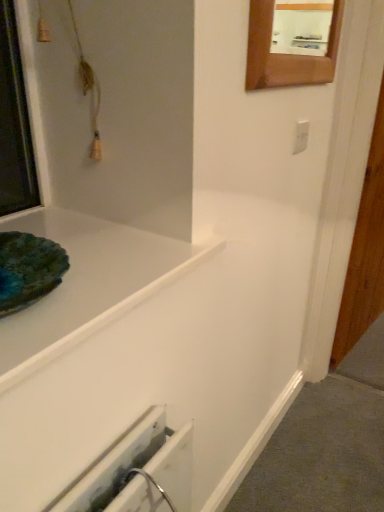
Question: Considering the relative sizes of white glossy bathtub at upper left and wooden frame mirror at upper right in the image provided, is white glossy bathtub at upper left shorter than wooden frame mirror at upper right?

Choices:
 (A) no
 (B) yes

Answer: (B)

Question: From a real-world perspective, does white glossy bathtub at upper left sit lower than wooden frame mirror at upper right?

Choices:
 (A) no
 (B) yes

Answer: (B)

Question: Is wooden frame mirror at upper right located within white glossy bathtub at upper left?

Choices:
 (A) no
 (B) yes

Answer: (A)

Question: Is there a large distance between white glossy bathtub at upper left and wooden frame mirror at upper right?

Choices:
 (A) yes
 (B) no

Answer: (B)

Question: Is white glossy bathtub at upper left bigger than wooden frame mirror at upper right?

Choices:
 (A) yes
 (B) no

Answer: (A)

Question: Could you tell me if white glossy bathtub at upper left is turned towards wooden frame mirror at upper right?

Choices:
 (A) yes
 (B) no

Answer: (B)

Question: Does white plastic electric outlet at upper right touch wooden frame mirror at upper right?

Choices:
 (A) no
 (B) yes

Answer: (A)

Question: Considering the relative sizes of white plastic electric outlet at upper right and wooden frame mirror at upper right in the image provided, is white plastic electric outlet at upper right taller than wooden frame mirror at upper right?

Choices:
 (A) no
 (B) yes

Answer: (A)

Question: From a real-world perspective, is white plastic electric outlet at upper right beneath wooden frame mirror at upper right?

Choices:
 (A) yes
 (B) no

Answer: (A)

Question: Is white plastic electric outlet at upper right oriented towards wooden frame mirror at upper right?

Choices:
 (A) no
 (B) yes

Answer: (A)

Question: Can you confirm if white plastic electric outlet at upper right is smaller than wooden frame mirror at upper right?

Choices:
 (A) no
 (B) yes

Answer: (B)

Question: Considering the relative positions of white plastic electric outlet at upper right and wooden frame mirror at upper right in the image provided, is white plastic electric outlet at upper right to the right of wooden frame mirror at upper right from the viewer's perspective?

Choices:
 (A) no
 (B) yes

Answer: (B)

Question: Considering the relative sizes of wooden frame mirror at upper right and white plastic electric outlet at upper right in the image provided, is wooden frame mirror at upper right wider than white plastic electric outlet at upper right?

Choices:
 (A) no
 (B) yes

Answer: (B)